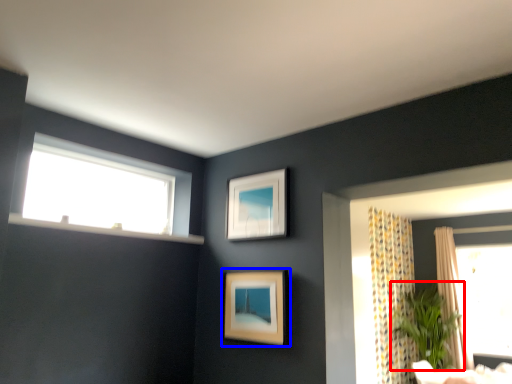
Question: Which object is further to the camera taking this photo, plant (highlighted by a red box) or picture frame (highlighted by a blue box)?

Choices:
 (A) plant
 (B) picture frame

Answer: (A)